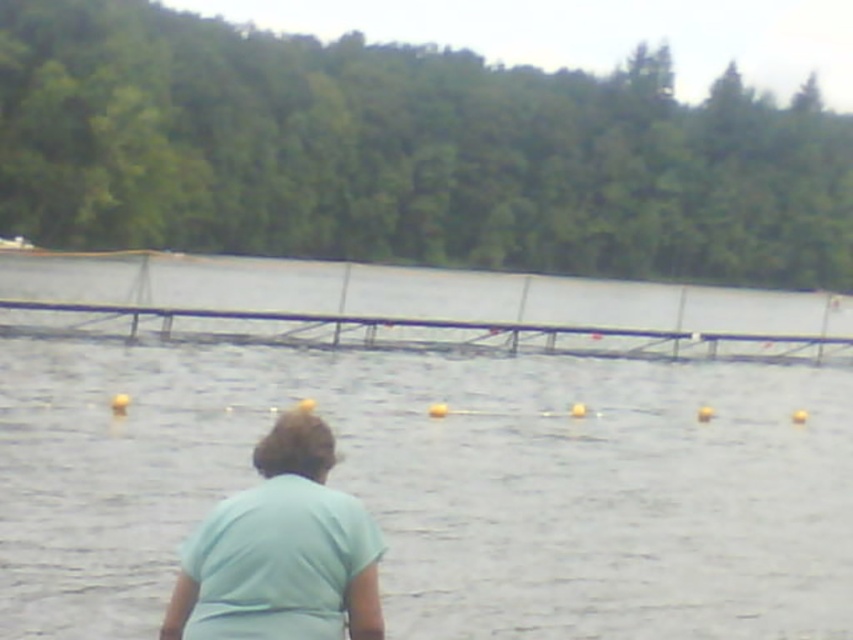
Based on the photo, you are a swimmer preparing to enter the water. You see the clear water at center and the light blue fabric at center. Which one is the surface of the water?

The clear water at center is the surface of the water because it is positioned over the light blue fabric at center, indicating the fabric is submerged beneath the water.

You are standing on the edge of the water and see the clear water at center and the light blue fabric at center. Which object is closer to your left side?

The clear water at center is closer to your left side because it is positioned to the left of the light blue fabric at center.